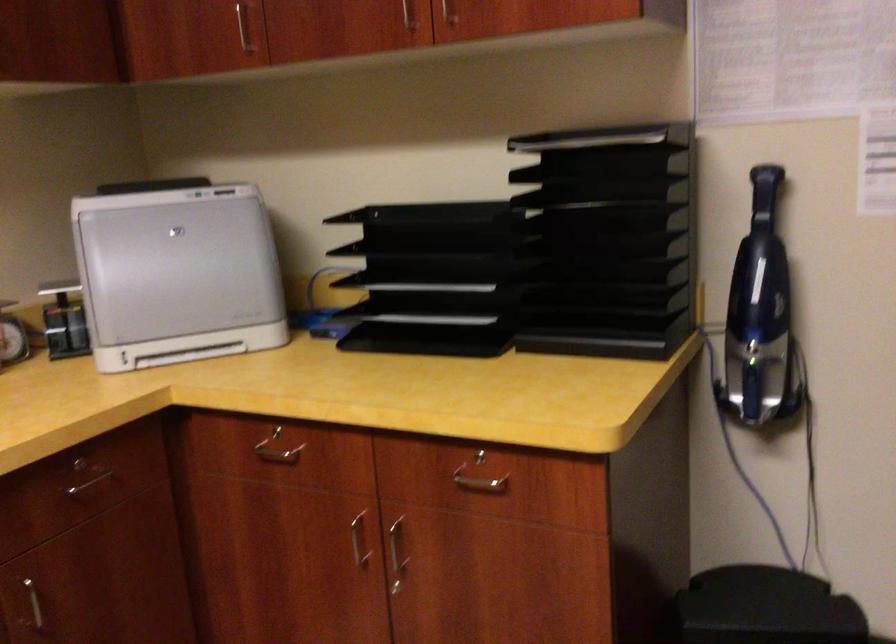
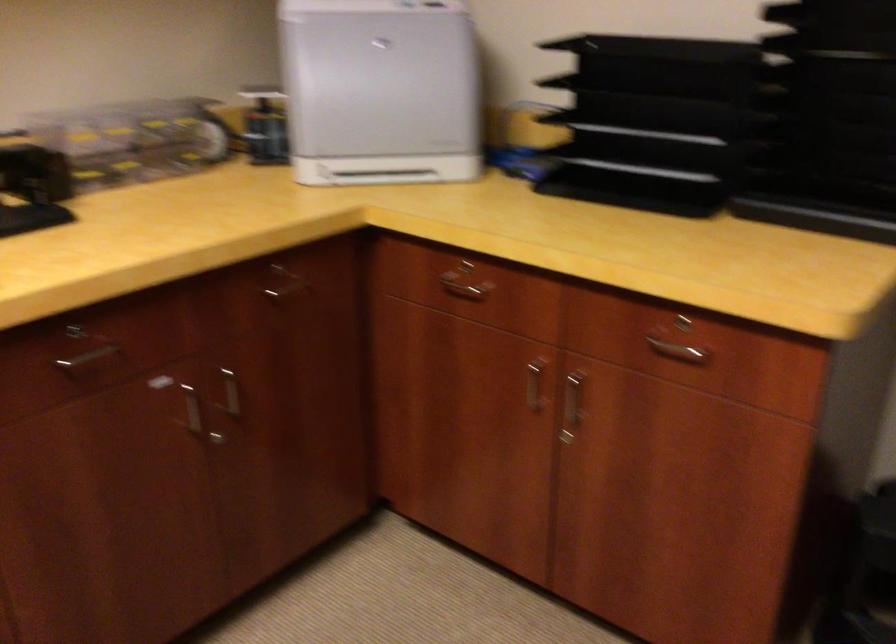
In the second image, find the point that corresponds to point (481, 484) in the first image.

(677, 351)